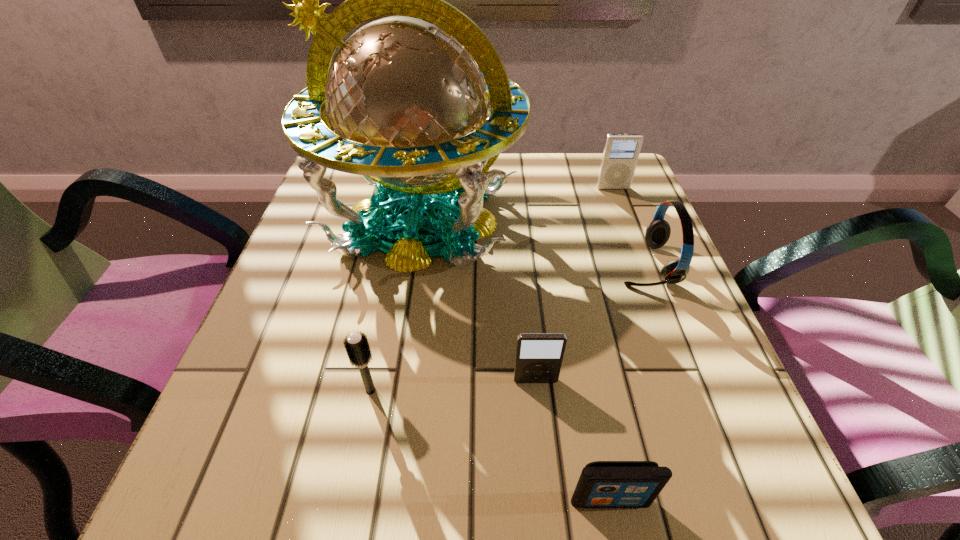
This screenshot has height=540, width=960. I want to click on free location located with the microphone attached to the side of the headset, so click(x=556, y=265).

I want to click on vacant region located with the microphone attached to the side of the headset, so pos(427,265).

Image resolution: width=960 pixels, height=540 pixels. Find the location of `free region located 0.220m with the microphone attached to the side of the headset`. free region located 0.220m with the microphone attached to the side of the headset is located at coordinates (504, 265).

I want to click on vacant space located on the right of the hairbrush, so click(608, 390).

You are a GUI agent. You are given a task and a screenshot of the screen. Output one action in this format:
    pyautogui.click(x=<x>, y=<y>)
    Task: Click on the free space located on the front-facing side of the second farthest iPod
    The height and width of the screenshot is (540, 960).
    Given the screenshot: What is the action you would take?
    (547, 495)

Locate an element on the screen. globe positioned at the far edge is located at coordinates (405, 102).

Where is `iPod located at the far edge`? iPod located at the far edge is located at coordinates (621, 152).

Find the location of a particular element. Image resolution: width=960 pixels, height=540 pixels. object positioned at the near edge is located at coordinates (602, 484).

Identify the location of object that is at the left edge. The image size is (960, 540). pyautogui.click(x=405, y=102).

Image resolution: width=960 pixels, height=540 pixels. What are the coordinates of `iPod at the right edge` in the screenshot? It's located at (621, 152).